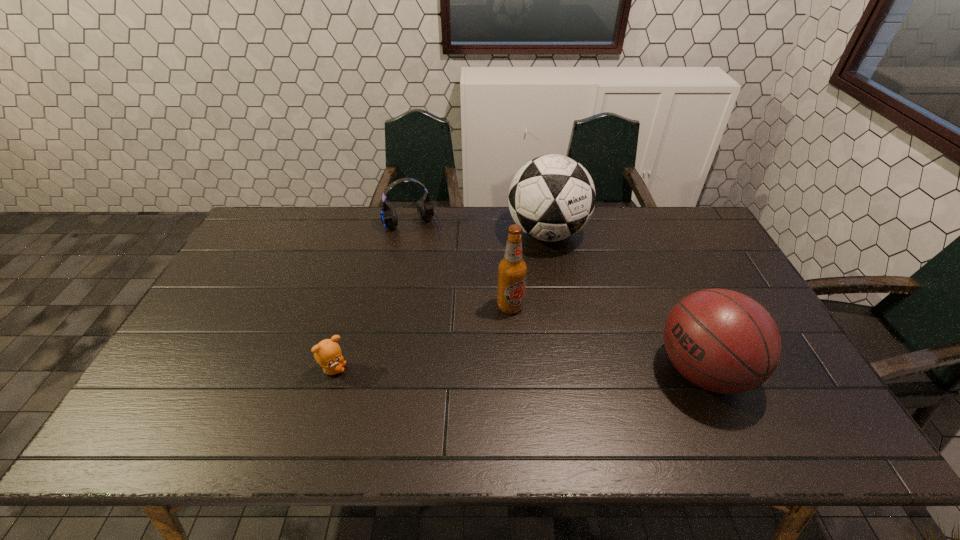
Where is `free space located on the front label of the third farthest object`? The image size is (960, 540). free space located on the front label of the third farthest object is located at coordinates (557, 387).

Locate an element on the screen. This screenshot has width=960, height=540. vacant region located on the ear cushions of the second shortest object is located at coordinates (451, 298).

You are a GUI agent. You are given a task and a screenshot of the screen. Output one action in this format:
    pyautogui.click(x=<x>, y=<y>)
    Task: Click on the free location located on the ear cushions of the second shortest object
    Image resolution: width=960 pixels, height=540 pixels.
    Given the screenshot: What is the action you would take?
    pyautogui.click(x=440, y=274)

Image resolution: width=960 pixels, height=540 pixels. In order to click on vacant space located on the ear cushions of the second shortest object in this screenshot , I will do `click(432, 259)`.

Where is `vacant point located 0.230m on the surface of the soccer ball where the brand logo is visible`? vacant point located 0.230m on the surface of the soccer ball where the brand logo is visible is located at coordinates (549, 312).

Locate an element on the screen. The image size is (960, 540). free space located on the surface of the soccer ball where the brand logo is visible is located at coordinates (550, 339).

I want to click on free space located on the surface of the soccer ball where the brand logo is visible, so click(548, 287).

I want to click on headset at the far edge, so click(x=425, y=209).

The height and width of the screenshot is (540, 960). Identify the location of soccer ball at the far edge. (552, 197).

Where is `teddy bear positioned at the near edge`? The width and height of the screenshot is (960, 540). teddy bear positioned at the near edge is located at coordinates (327, 353).